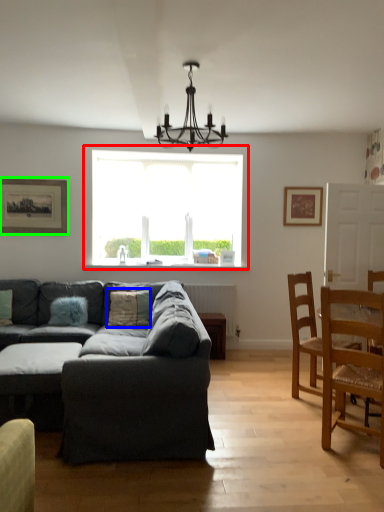
Question: Based on their relative distances, which object is farther from window (highlighted by a red box)? Choose from pillow (highlighted by a blue box) and picture frame (highlighted by a green box).

Choices:
 (A) pillow
 (B) picture frame

Answer: (A)